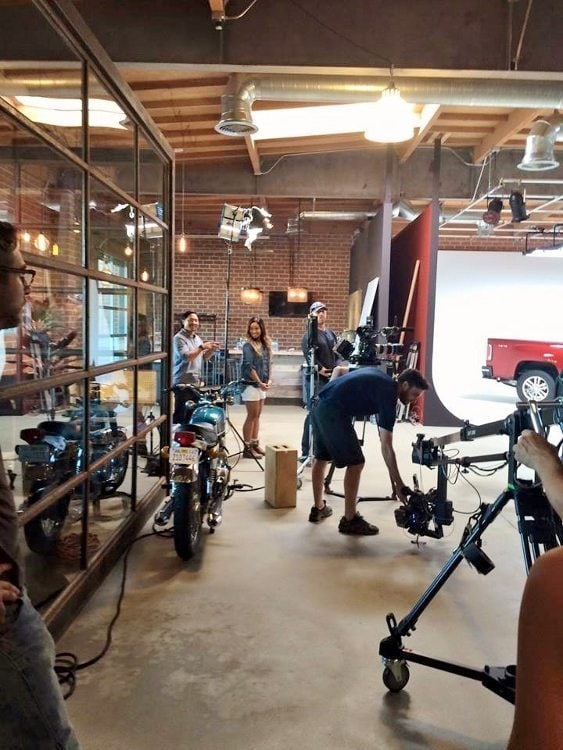
This screenshot has height=750, width=563. In order to click on brick wall in this screenshot , I will do `click(352, 259)`.